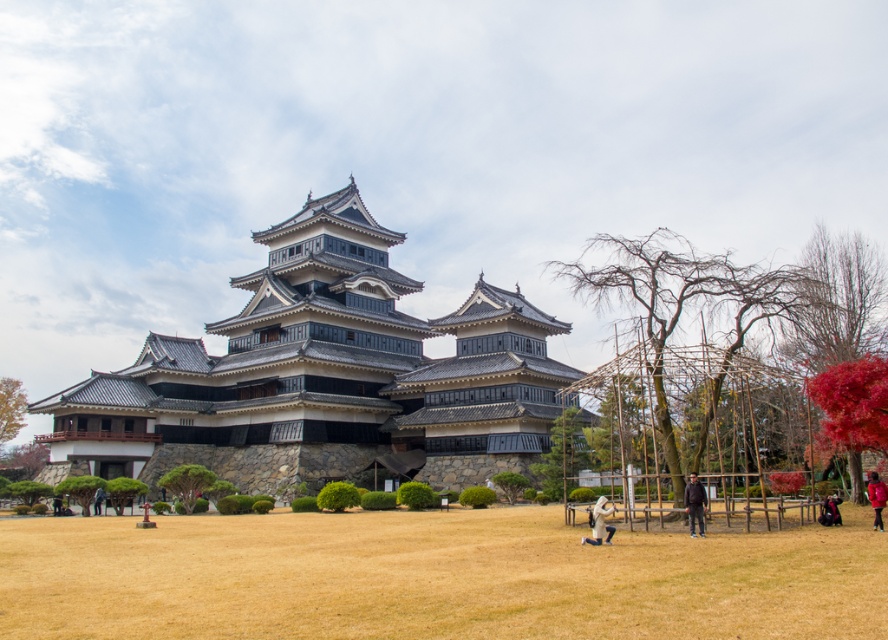
Question: Which point is farther from the camera taking this photo?

Choices:
 (A) (1, 435)
 (B) (4, 472)

Answer: (A)

Question: Where is green leafy tree at center located in relation to dark blue jacket at lower right in the image?

Choices:
 (A) right
 (B) left

Answer: (B)

Question: Which point is closer to the camera taking this photo?

Choices:
 (A) pos(36,458)
 (B) pos(834,509)

Answer: (B)

Question: Can you confirm if green leafy bush at lower left is positioned to the left of green leafy tree at lower left?

Choices:
 (A) no
 (B) yes

Answer: (A)

Question: Does brown grass at center have a greater width compared to dark blue jacket at lower right?

Choices:
 (A) no
 (B) yes

Answer: (B)

Question: Among these points, which one is nearest to the camera?

Choices:
 (A) (694, 492)
 (B) (494, 552)
 (C) (609, 509)
 (D) (871, 472)

Answer: (B)